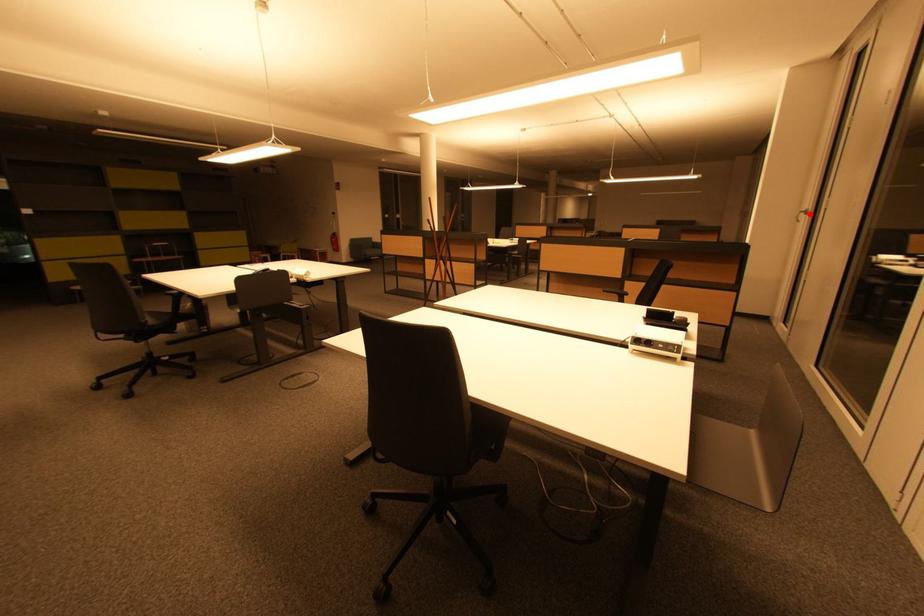
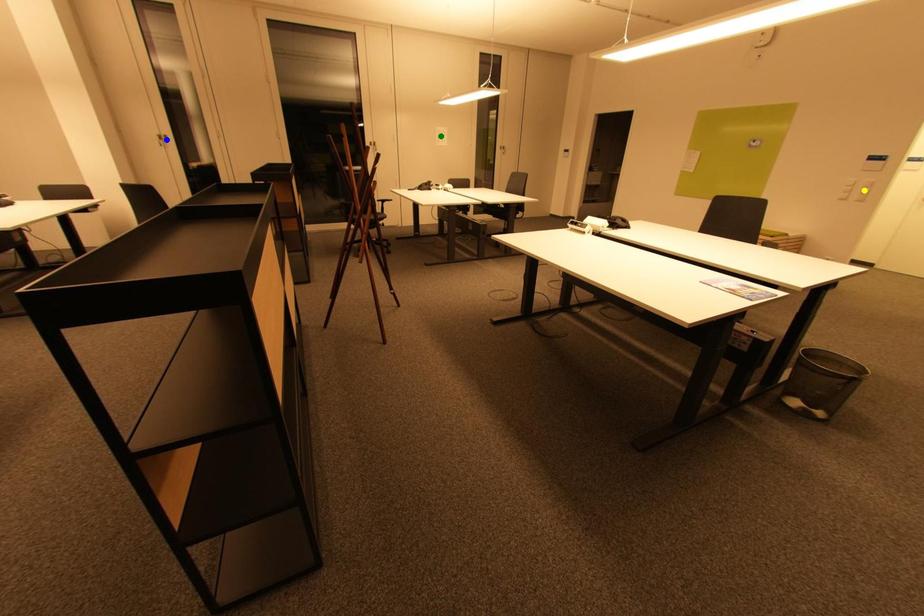
Question: I am providing you with two images of the same scene from different viewpoints. A red point is marked on the first image. You are given multiple points on the second image. Which point in image 2 represents the same 3d spot as the red point in image 1?

Choices:
 (A) green point
 (B) yellow point
 (C) blue point

Answer: (C)